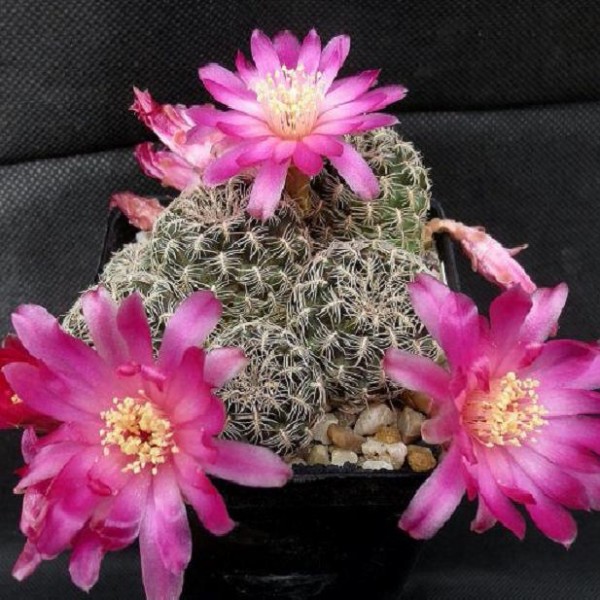
Identify the location of flower pot. Image resolution: width=600 pixels, height=600 pixels. (370, 538).